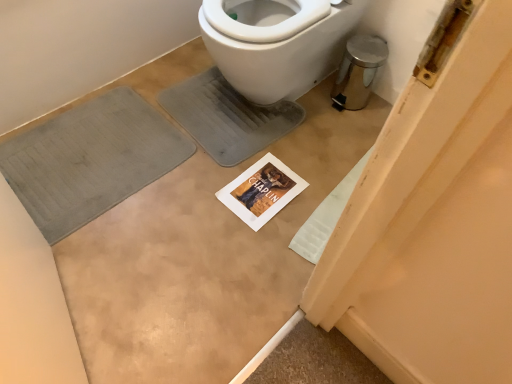
Question: Considering the relative sizes of gray fabric bath mat at lower left and white plastic bidet at upper center in the image provided, is gray fabric bath mat at lower left bigger than white plastic bidet at upper center?

Choices:
 (A) yes
 (B) no

Answer: (B)

Question: Can you see gray fabric bath mat at lower left touching white plastic bidet at upper center?

Choices:
 (A) no
 (B) yes

Answer: (A)

Question: Is gray fabric bath mat at lower left aimed at white plastic bidet at upper center?

Choices:
 (A) yes
 (B) no

Answer: (B)

Question: Considering the relative sizes of gray fabric bath mat at lower left and white plastic bidet at upper center in the image provided, is gray fabric bath mat at lower left wider than white plastic bidet at upper center?

Choices:
 (A) no
 (B) yes

Answer: (A)

Question: Is gray fabric bath mat at lower left positioned beyond the bounds of white plastic bidet at upper center?

Choices:
 (A) no
 (B) yes

Answer: (B)

Question: From the image's perspective, does gray fabric bath mat at lower left appear lower than white plastic bidet at upper center?

Choices:
 (A) no
 (B) yes

Answer: (B)

Question: Considering the relative sizes of white plastic bidet at upper center and gray fabric bath mat at lower left in the image provided, is white plastic bidet at upper center bigger than gray fabric bath mat at lower left?

Choices:
 (A) no
 (B) yes

Answer: (B)

Question: From a real-world perspective, is white plastic bidet at upper center over gray fabric bath mat at lower left?

Choices:
 (A) no
 (B) yes

Answer: (B)

Question: Can you confirm if white plastic bidet at upper center is positioned to the left of gray fabric bath mat at lower left?

Choices:
 (A) no
 (B) yes

Answer: (A)

Question: From the image's perspective, would you say white plastic bidet at upper center is positioned over gray fabric bath mat at lower left?

Choices:
 (A) yes
 (B) no

Answer: (A)

Question: From the image's perspective, would you say white plastic bidet at upper center is shown under gray fabric bath mat at lower left?

Choices:
 (A) yes
 (B) no

Answer: (B)

Question: Does white plastic bidet at upper center appear on the right side of gray fabric bath mat at lower left?

Choices:
 (A) no
 (B) yes

Answer: (B)

Question: Is point click(30, 180) closer or farther from the camera than point click(263, 0)?

Choices:
 (A) closer
 (B) farther

Answer: (B)